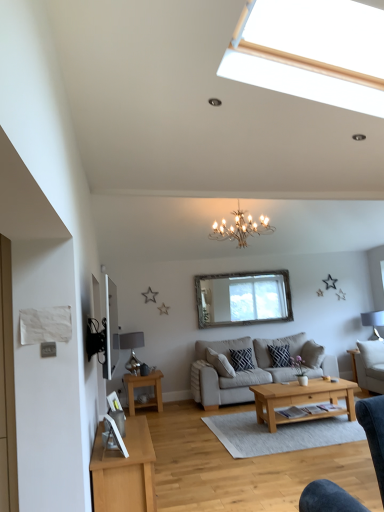
Question: Considering the relative sizes of beige fabric couch at center and white fabric lampshade at right, positioned as the 1th lamp in right-to-left order, in the image provided, is beige fabric couch at center wider than white fabric lampshade at right, positioned as the 1th lamp in right-to-left order,?

Choices:
 (A) yes
 (B) no

Answer: (A)

Question: From a real-world perspective, is beige fabric couch at center positioned over white fabric lampshade at right, the 2th lamp viewed from the left, based on gravity?

Choices:
 (A) yes
 (B) no

Answer: (B)

Question: Is beige fabric couch at center smaller than white fabric lampshade at right, positioned as the 1th lamp in right-to-left order?

Choices:
 (A) yes
 (B) no

Answer: (B)

Question: Is beige fabric couch at center not inside white fabric lampshade at right, placed as the second lamp when sorted from front to back?

Choices:
 (A) no
 (B) yes

Answer: (B)

Question: Is beige fabric couch at center to the left of white fabric lampshade at right, the 2th lamp viewed from the left, from the viewer's perspective?

Choices:
 (A) yes
 (B) no

Answer: (A)

Question: Considering the positions of white fabric lampshade at right, placed as the second lamp when sorted from front to back, and light brown wooden coffee table at center in the image, is white fabric lampshade at right, placed as the second lamp when sorted from front to back, wider or thinner than light brown wooden coffee table at center?

Choices:
 (A) wide
 (B) thin

Answer: (B)

Question: In the image, is white fabric lampshade at right, placed as the second lamp when sorted from front to back, positioned in front of or behind light brown wooden coffee table at center?

Choices:
 (A) behind
 (B) front

Answer: (A)

Question: Considering the relative positions of white fabric lampshade at right, marked as the first lamp in a back-to-front arrangement, and light brown wooden coffee table at center in the image provided, is white fabric lampshade at right, marked as the first lamp in a back-to-front arrangement, to the left or to the right of light brown wooden coffee table at center?

Choices:
 (A) left
 (B) right

Answer: (B)

Question: From their relative heights in the image, would you say white fabric lampshade at right, marked as the first lamp in a back-to-front arrangement, is taller or shorter than light brown wooden coffee table at center?

Choices:
 (A) tall
 (B) short

Answer: (A)

Question: In the image, is light brown wooden coffee table at center positioned in front of or behind clear glass window at center?

Choices:
 (A) behind
 (B) front

Answer: (B)

Question: Considering the positions of light brown wooden coffee table at center and clear glass window at center in the image, is light brown wooden coffee table at center wider or thinner than clear glass window at center?

Choices:
 (A) thin
 (B) wide

Answer: (B)

Question: Is point (340, 414) closer or farther from the camera than point (281, 282)?

Choices:
 (A) farther
 (B) closer

Answer: (B)

Question: Based on their sizes in the image, would you say light brown wooden coffee table at center is bigger or smaller than clear glass window at center?

Choices:
 (A) small
 (B) big

Answer: (B)

Question: From the image's perspective, is beige fabric couch at center positioned above or below light brown wooden coffee table at center?

Choices:
 (A) above
 (B) below

Answer: (A)

Question: Based on their sizes in the image, would you say beige fabric couch at center is bigger or smaller than light brown wooden coffee table at center?

Choices:
 (A) big
 (B) small

Answer: (A)